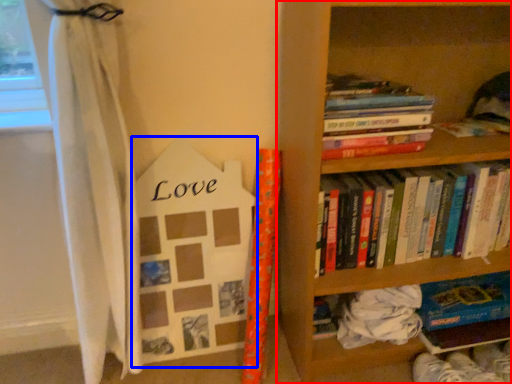
Question: Which object appears farthest to the camera in this image, bookcase (highlighted by a red box) or paperback book (highlighted by a blue box)?

Choices:
 (A) bookcase
 (B) paperback book

Answer: (B)